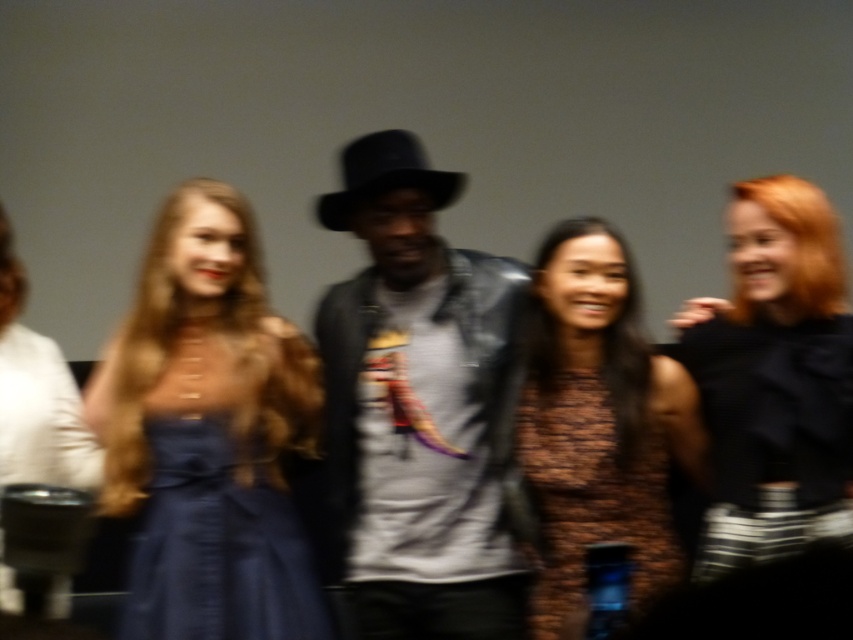
You are a photographer trying to adjust the lighting for a photo shoot. You notice two dresses in the frame, the black satin dress at right and the brown textured dress at center. Which dress is closer to the camera?

The black satin dress at right is closer to the camera than the brown textured dress at center.

You are trying to identify the position of the black satin dress at right in the image. According to the coordinates provided, where exactly is it located?

The black satin dress at right is located at point (775, 380).

You are a photographer trying to adjust the lighting for a group photo. You notice the denim jacket at center and the satin blue dress at center. Which object requires more space in the frame to avoid being cut off?

The denim jacket at center requires more space in the frame because its width is larger than the satin blue dress at center, so it is more likely to be cut off if not given enough space.